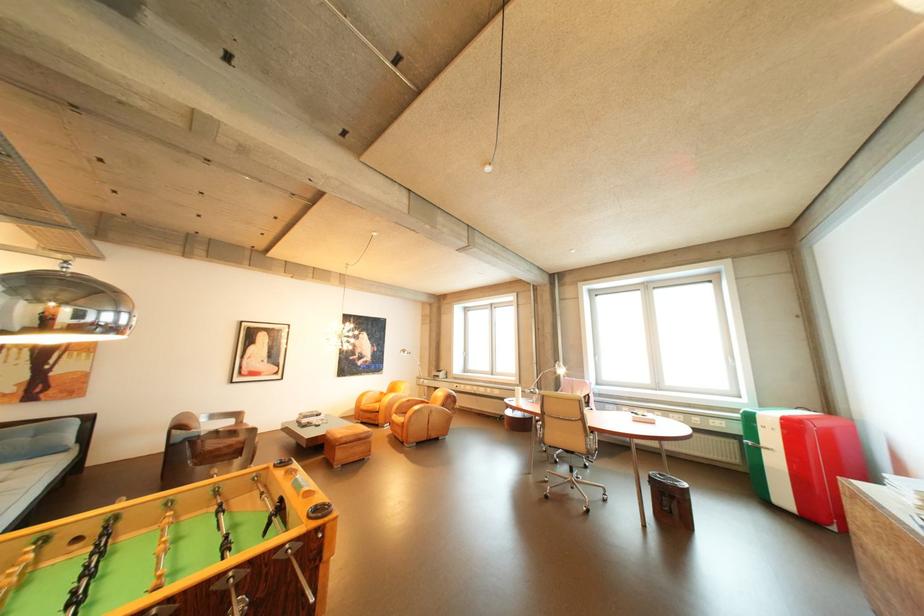
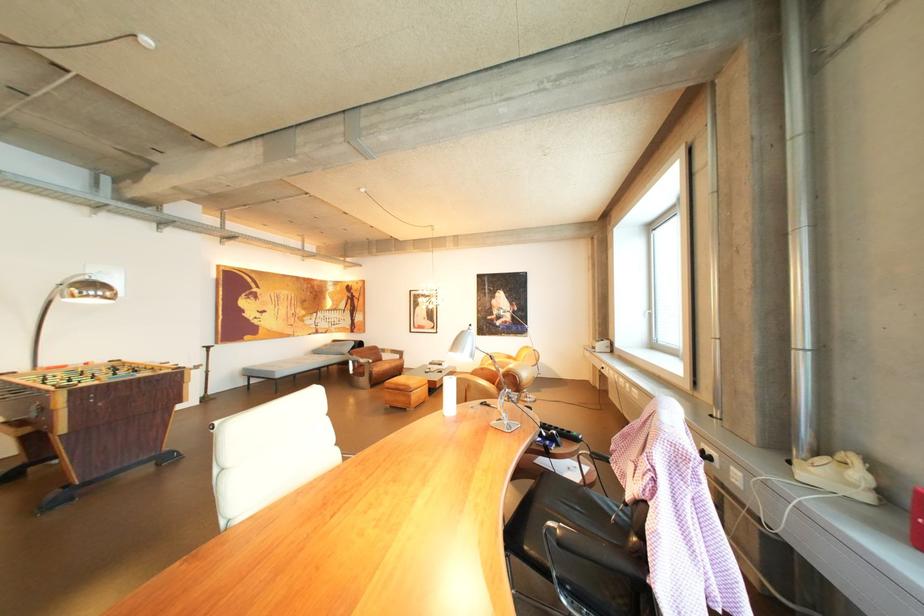
In the second image, find the point that corresponds to (x=383, y=444) in the first image.

(422, 398)